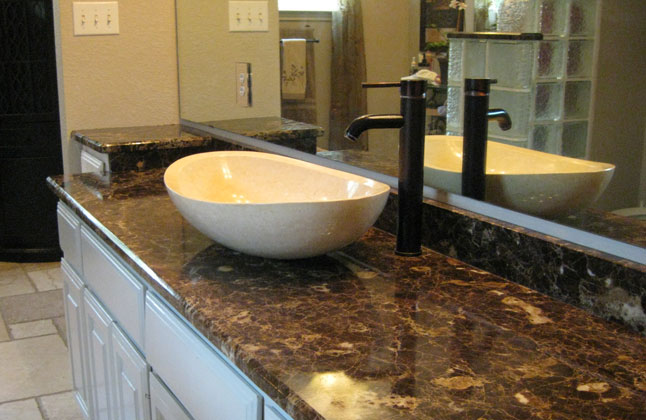
You are a GUI agent. You are given a task and a screenshot of the screen. Output one action in this format:
    pyautogui.click(x=<x>, y=<y>)
    Task: Click on the countertop
    This screenshot has width=646, height=420.
    Given the screenshot: What is the action you would take?
    pyautogui.click(x=441, y=326), pyautogui.click(x=138, y=136)